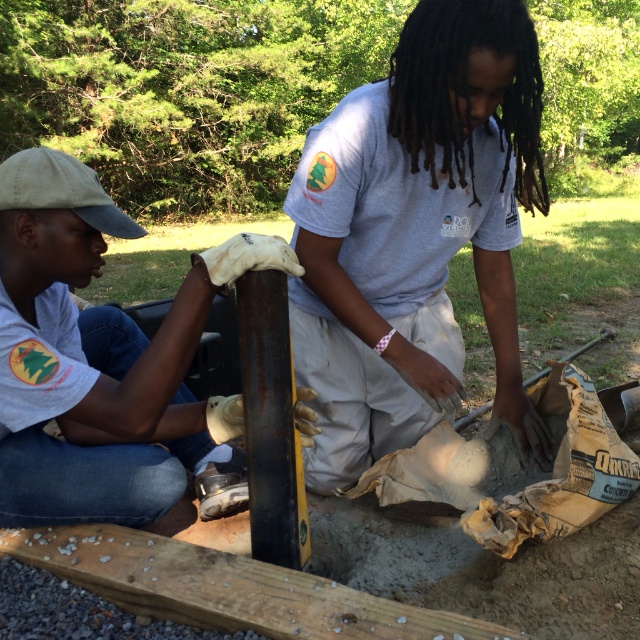
You are standing at the origin point of the coordinate system in the image. The smooth wooden plank at center is at point (227, 588). If you want to move towards the smooth wooden plank at center, in which direction should you go?

The smooth wooden plank at center is located at point (227, 588), so you should move towards that coordinate to reach it.

Based on the scene description, can you determine the spatial relationship between the white matte cap at upper left and the smooth wooden plank at center?

The white matte cap at upper left is positioned to the left of the smooth wooden plank at center.